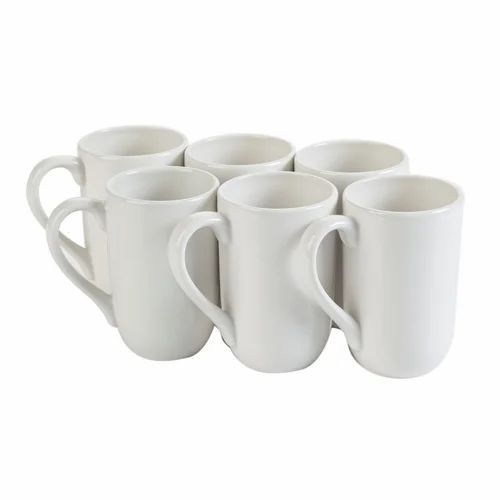
I want to click on coffee mugs with handle, so click(48, 166), click(70, 205), click(179, 245), click(309, 257).